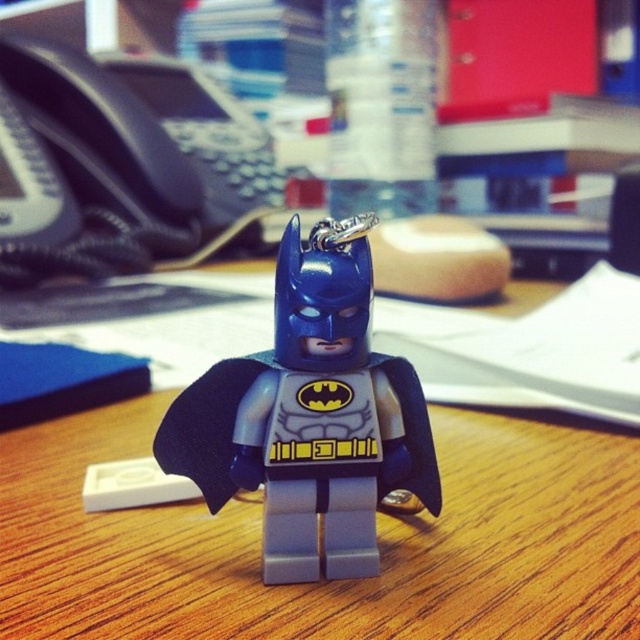
You are organizing items on the wooden desk at center and the matte plastic batman keychain at center. Which object has a greater width?

The wooden desk at center has a greater width than the matte plastic batman keychain at center.

You are organizing your desk and want to place the matte plastic batman keychain at center on the wooden desk at center. Can you fit the keychain on the desk?

The wooden desk at center is bigger than the matte plastic batman keychain at center, so yes, the keychain will fit on the desk.

You are a delivery robot that needs to place a small package on the wooden desk at center. However, there is a matte plastic batman keychain at center in the way. Can you move the keychain to the side to make space?

The wooden desk at center is in front of the matte plastic batman keychain at center, meaning the keychain is behind the desk. Since the keychain is not on the desk surface, you don not need to move it to place the package on the desk.